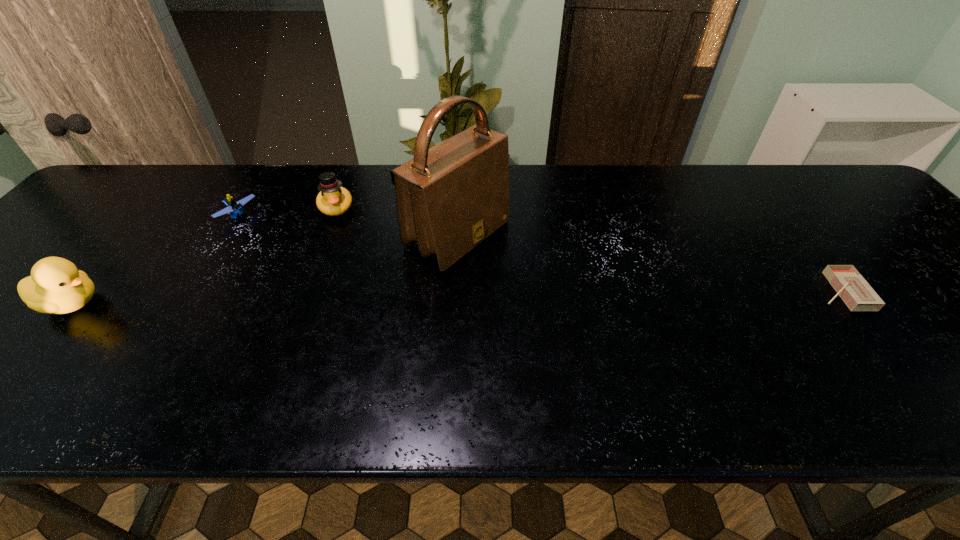
Where is `the nearer duck`? This screenshot has width=960, height=540. the nearer duck is located at coordinates point(56,286).

The width and height of the screenshot is (960, 540). What are the coordinates of `the left duck` in the screenshot? It's located at click(x=56, y=286).

Image resolution: width=960 pixels, height=540 pixels. I want to click on matchbox, so click(849, 284).

Locate an element on the screen. Image resolution: width=960 pixels, height=540 pixels. the rightmost object is located at coordinates (849, 284).

Find the location of `the third object from left to right`. the third object from left to right is located at coordinates (333, 200).

At what (x,y) coordinates should I click in order to perform the action: click on the right duck. Please return your answer as a coordinate pair (x, y). The image size is (960, 540). Looking at the image, I should click on (333, 200).

The image size is (960, 540). In order to click on the fourth object from left to right in this screenshot , I will do `click(451, 197)`.

Identify the location of the tallest object. The image size is (960, 540). (451, 197).

Where is `the fourth object from right to left`? Image resolution: width=960 pixels, height=540 pixels. the fourth object from right to left is located at coordinates (234, 208).

The height and width of the screenshot is (540, 960). In order to click on Lego in this screenshot , I will do `click(234, 208)`.